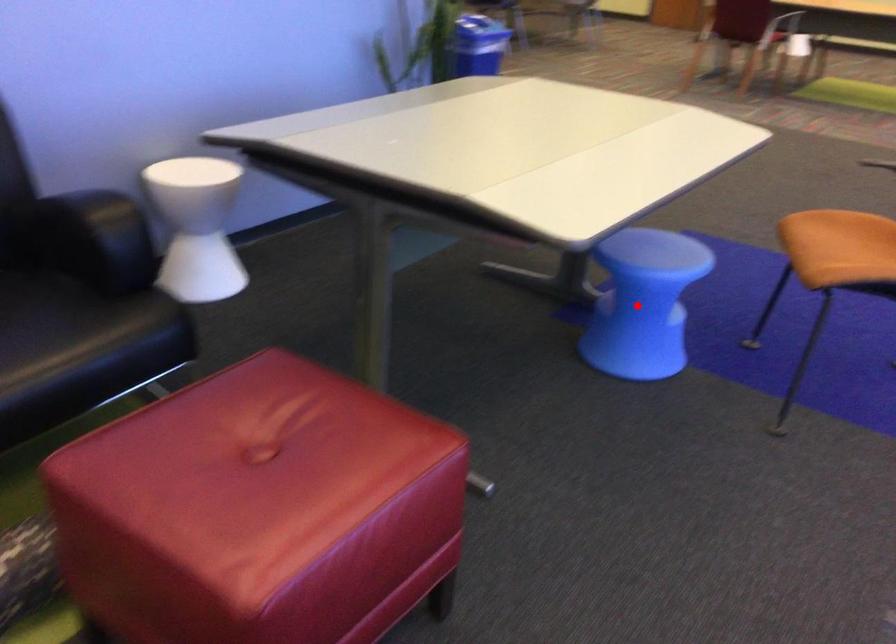
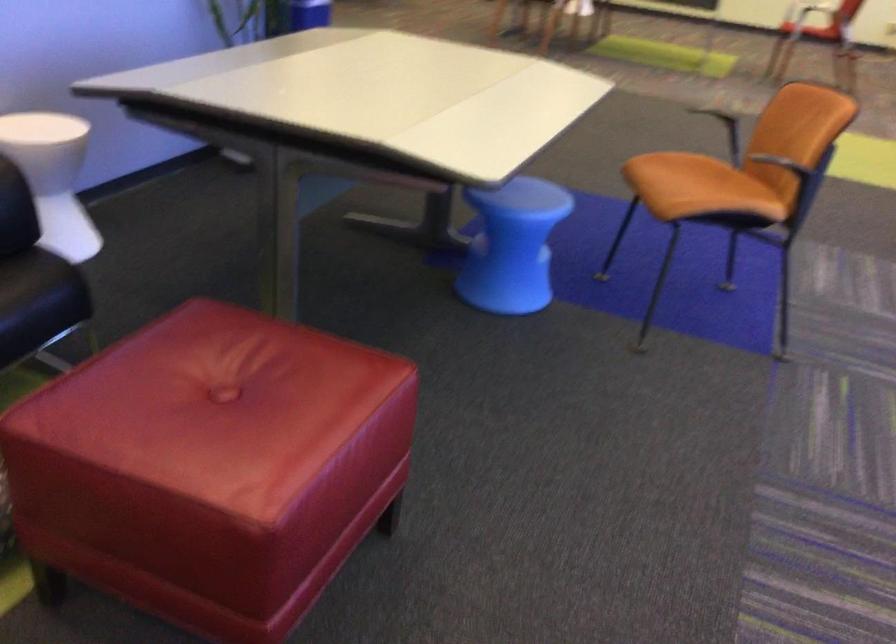
Find the pixel in the second image that matches the highlighted location in the first image.

(512, 245)